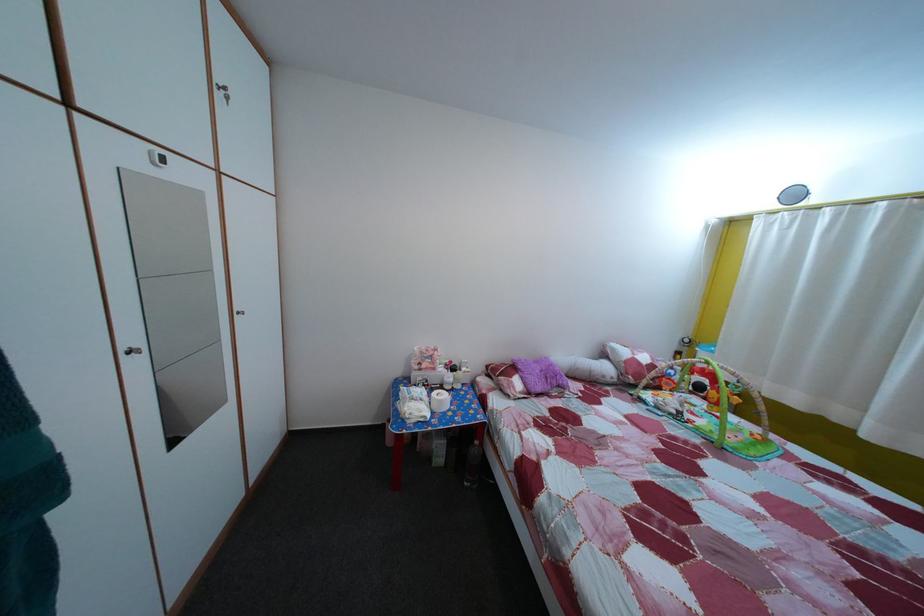
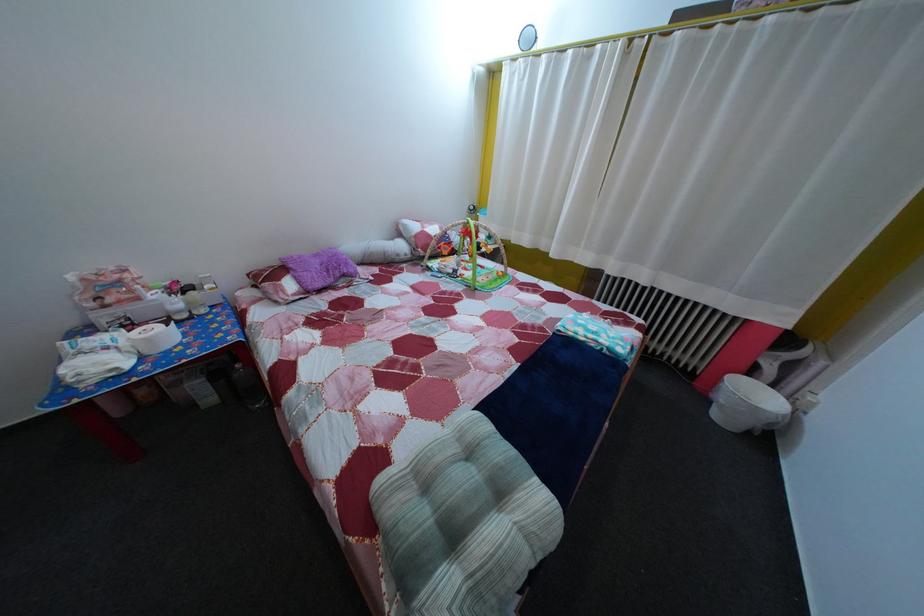
Where in the second image is the point corresponding to point (545, 370) from the first image?

(325, 262)